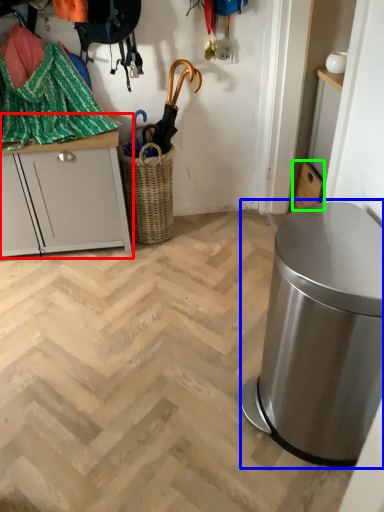
Question: Based on their relative distances, which object is nearer to cabinetry (highlighted by a red box)? Choose from waste container (highlighted by a blue box) and cabinetry (highlighted by a green box).

Choices:
 (A) waste container
 (B) cabinetry

Answer: (A)